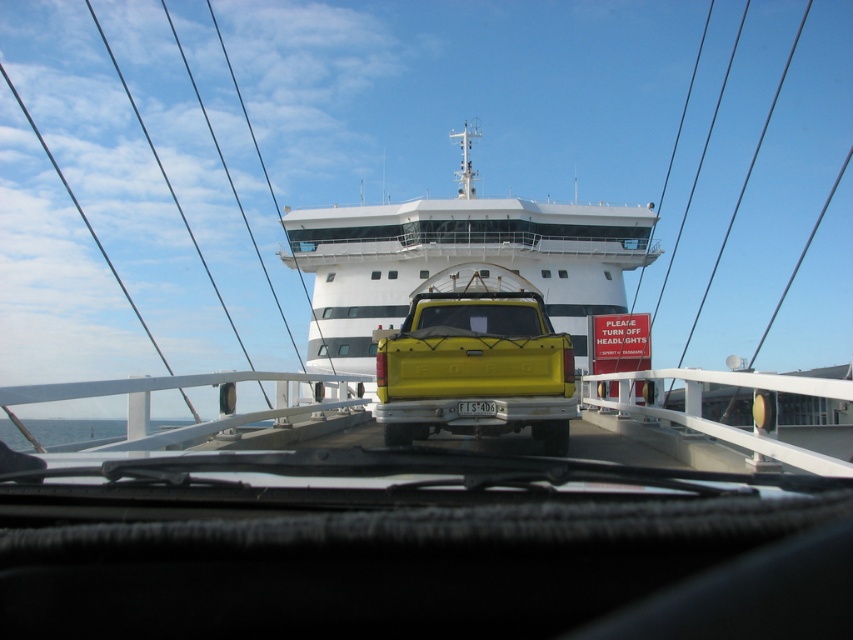
You are a passenger on a ferry and want to locate the white glossy cruise ship at upper center. Based on the coordinates given, where exactly should you look on the ferry deck?

The white glossy cruise ship at upper center is located at coordinates point (457,259) on the ferry deck.

You are a passenger on the ferry and want to take a photo of the white glossy cruise ship at upper center through the transparent glass windshield at center. Will the cruise ship be fully visible in your photo?

The white glossy cruise ship at upper center is positioned over the transparent glass windshield at center, so part of the cruise ship will be blocked by the windshield frame and thus not fully visible in the photo.

You are a passenger on the ferry and want to locate the yellow matte truck at center and the white plastic license plate at center. Based on their positions, which object is closer to the right edge of the ferry deck?

The yellow matte truck at center is positioned on the right side of the white plastic license plate at center, so the yellow matte truck at center is closer to the right edge of the ferry deck.